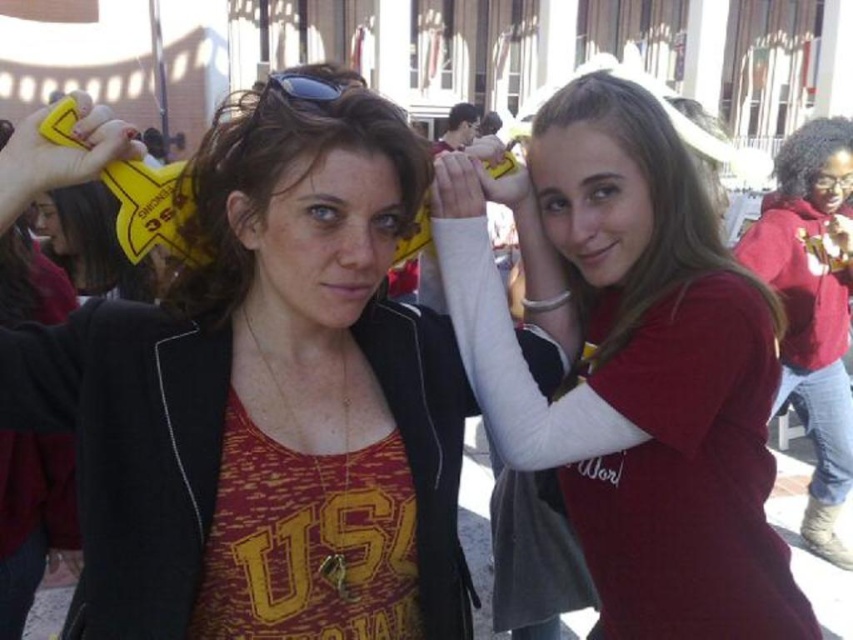
Question: Is matte red shirt at center smaller than matte red hoodie at right?

Choices:
 (A) yes
 (B) no

Answer: (A)

Question: Which point is closer to the camera taking this photo?

Choices:
 (A) (369, 140)
 (B) (764, 550)
 (C) (323, 392)

Answer: (A)

Question: Which object appears closest to the camera in this image?

Choices:
 (A) matte red hoodie at right
 (B) matte red shirt at center
 (C) matte black hair at center
 (D) black rubber goggles at upper center

Answer: (C)

Question: Considering the relative positions of matte red hoodie at right and matte black hair at center in the image provided, where is matte red hoodie at right located with respect to matte black hair at center?

Choices:
 (A) right
 (B) left

Answer: (A)

Question: Which object is the farthest from the matte black hair at center?

Choices:
 (A) matte black jacket at center
 (B) matte red hoodie at right
 (C) black rubber goggles at upper center
 (D) matte red shirt at center

Answer: (B)

Question: Is matte red shirt at center thinner than matte black hair at center?

Choices:
 (A) no
 (B) yes

Answer: (A)